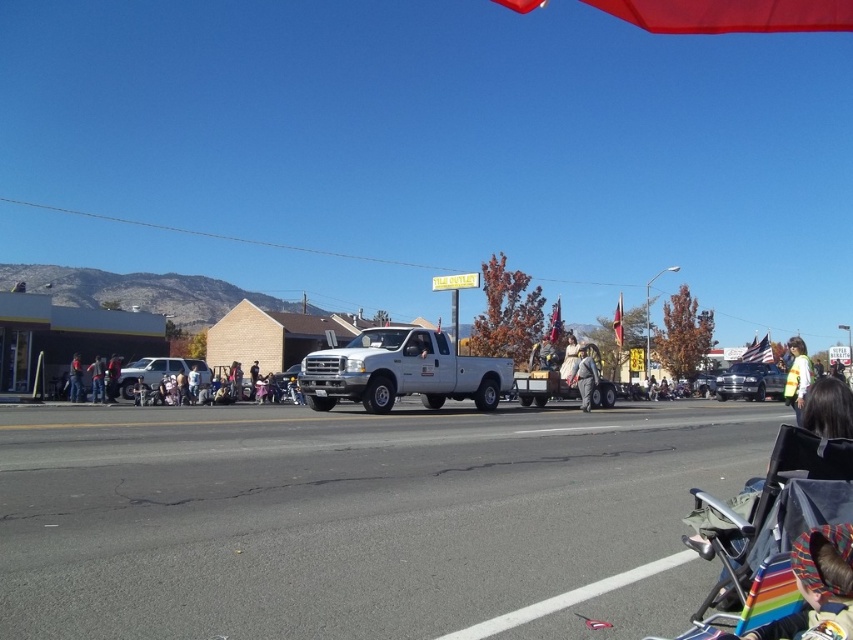
You are standing in the crowd watching the parade. You notice a red matte umbrella at upper center and light blue denim jeans at lower left. Which object is nearer to you?

The red matte umbrella at upper center is closer to the viewer than the light blue denim jeans at lower left.

You are attending the parade and want to take a photo of both the rainbow fabric baby carrier at lower right and the dark gray jacket at left. Which object should you focus on first if you want to capture them in the same frame without moving your camera?

You should focus on the dark gray jacket at left first because the rainbow fabric baby carrier at lower right is to the right of it, so keeping the jacket in the left side of the frame will allow both objects to be included without moving the camera.